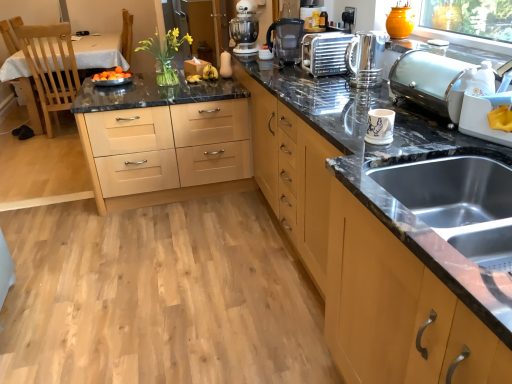
Find the location of a particular element. The image size is (512, 384). vacant area that is in front of matte wood chest of drawers at center is located at coordinates (153, 241).